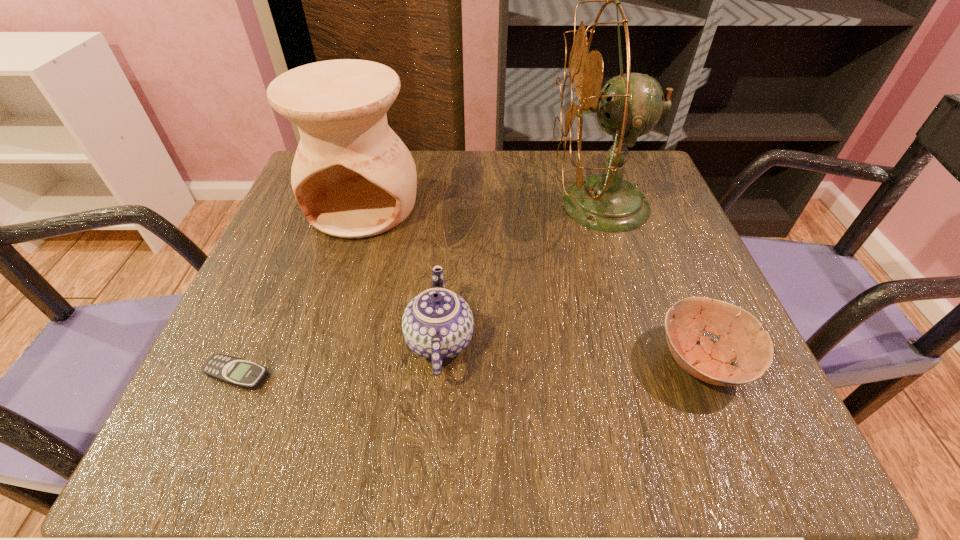
This screenshot has width=960, height=540. In order to click on object at the far left corner in this screenshot , I will do `click(353, 177)`.

The width and height of the screenshot is (960, 540). Identify the location of object at the far right corner. (630, 105).

Locate an element on the screen. Image resolution: width=960 pixels, height=540 pixels. object that is positioned at the near right corner is located at coordinates (740, 337).

At what (x,y) coordinates should I click in order to perform the action: click on vacant area at the far edge of the desktop. Please return your answer as a coordinate pair (x, y). Looking at the image, I should click on (525, 159).

In the image, there is a desktop. Identify the location of free space at the near edge. This screenshot has height=540, width=960. (547, 419).

In the image, there is a desktop. At what (x,y) coordinates should I click in order to perform the action: click on vacant space at the left edge. Please return your answer as a coordinate pair (x, y). Image resolution: width=960 pixels, height=540 pixels. Looking at the image, I should click on point(298,247).

Where is `vacant area at the right edge`? vacant area at the right edge is located at coordinates (660, 249).

At what (x,y) coordinates should I click in order to perform the action: click on vacant area at the far right corner. Please return your answer as a coordinate pair (x, y). This screenshot has width=960, height=540. Looking at the image, I should click on (645, 155).

Where is `free space at the near right corner of the desktop`? The image size is (960, 540). free space at the near right corner of the desktop is located at coordinates (796, 448).

This screenshot has height=540, width=960. Find the location of `free space that is in between the bowl and the pottery`. free space that is in between the bowl and the pottery is located at coordinates (533, 283).